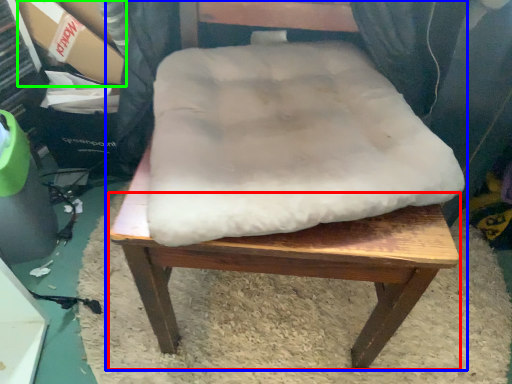
Question: Which object is positioned closest to step stool (highlighted by a red box)? Select from chair (highlighted by a blue box) and cardboard box (highlighted by a green box).

Choices:
 (A) chair
 (B) cardboard box

Answer: (A)